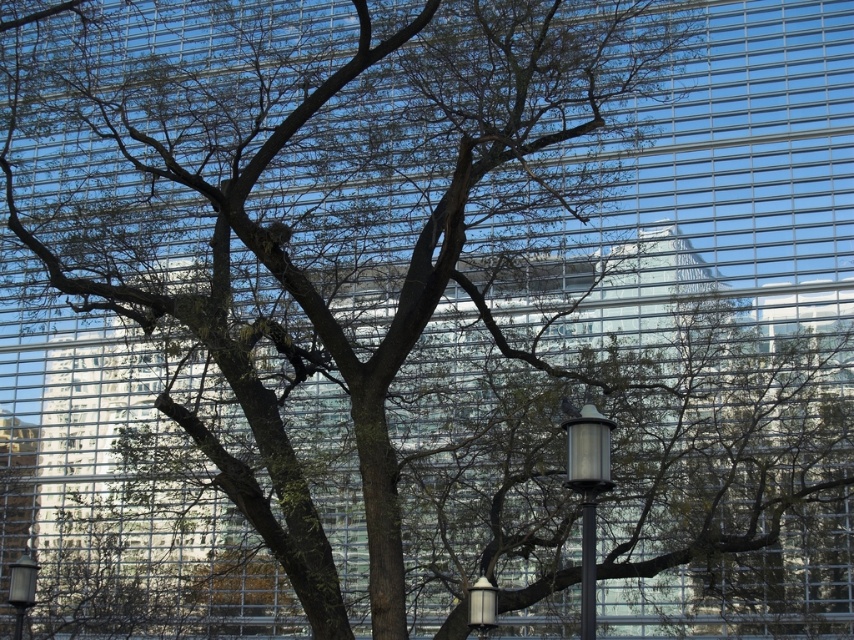
Between point (15, 624) and point (468, 614), which one is positioned in front?

Point (468, 614)

Can you confirm if metallic gray lamp post at lower left is thinner than metallic silver lamp at lower center?

Correct, metallic gray lamp post at lower left's width is less than metallic silver lamp at lower center's.

Does point (34, 572) come in front of point (471, 620)?

No, (34, 572) is behind (471, 620).

Where is `metallic gray lamp post at lower left`? The image size is (854, 640). metallic gray lamp post at lower left is located at coordinates (21, 588).

Is metallic gray lamp post at center to the left of metallic gray lamp post at lower left from the viewer's perspective?

Incorrect, metallic gray lamp post at center is not on the left side of metallic gray lamp post at lower left.

Who is more distant from viewer, (585, 609) or (15, 573)?

The point (15, 573) is behind.

The height and width of the screenshot is (640, 854). What are the coordinates of `metallic gray lamp post at center` in the screenshot? It's located at (588, 493).

Between metallic gray lamp post at center and metallic silver lamp at lower center, which one is positioned higher?

metallic gray lamp post at center is above.

Can you confirm if metallic gray lamp post at center is wider than metallic silver lamp at lower center?

Yes, metallic gray lamp post at center is wider than metallic silver lamp at lower center.

Locate an element on the screen. metallic gray lamp post at center is located at coordinates [588, 493].